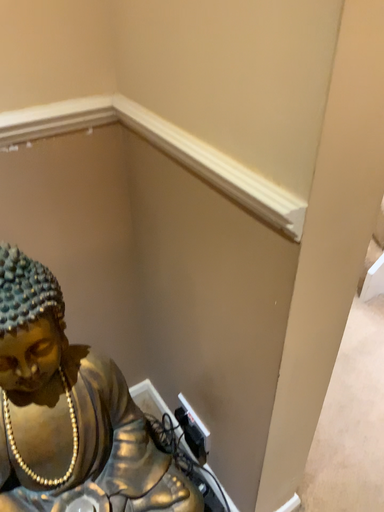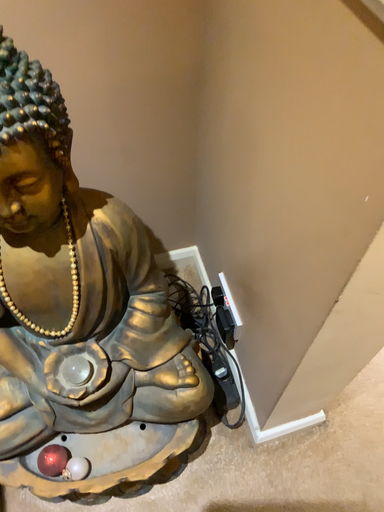
Question: How did the camera likely rotate when shooting the video?

Choices:
 (A) rotated left
 (B) rotated right

Answer: (A)